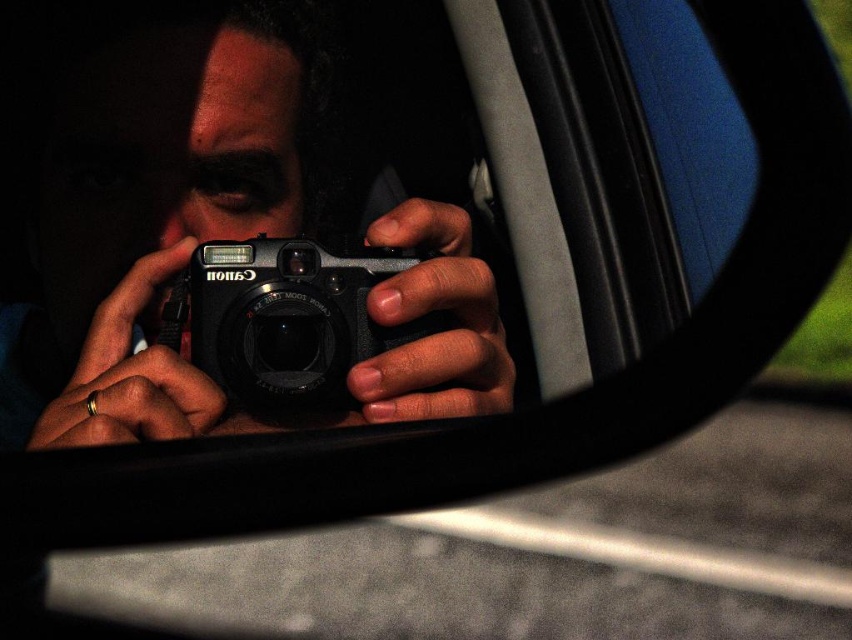
Question: Is matte black camera at center bigger than black plastic camera at center?

Choices:
 (A) yes
 (B) no

Answer: (A)

Question: Does matte black camera at center appear on the left side of black plastic camera at center?

Choices:
 (A) no
 (B) yes

Answer: (B)

Question: Which point appears closest to the camera in this image?

Choices:
 (A) (76, 401)
 (B) (266, 301)

Answer: (A)

Question: Among these objects, which one is nearest to the camera?

Choices:
 (A) matte black camera at center
 (B) black plastic camera at center

Answer: (A)

Question: Among these objects, which one is nearest to the camera?

Choices:
 (A) matte black camera at center
 (B) black plastic camera at center

Answer: (A)

Question: Can you confirm if matte black camera at center is thinner than black plastic camera at center?

Choices:
 (A) yes
 (B) no

Answer: (B)